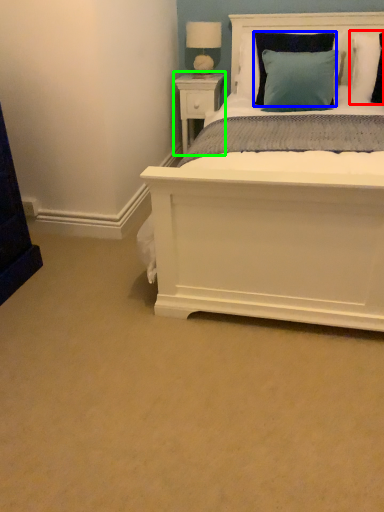
Question: Estimate the real-world distances between objects in this image. Which object is farther from pillow (highlighted by a red box), pillow (highlighted by a blue box) or nightstand (highlighted by a green box)?

Choices:
 (A) pillow
 (B) nightstand

Answer: (B)